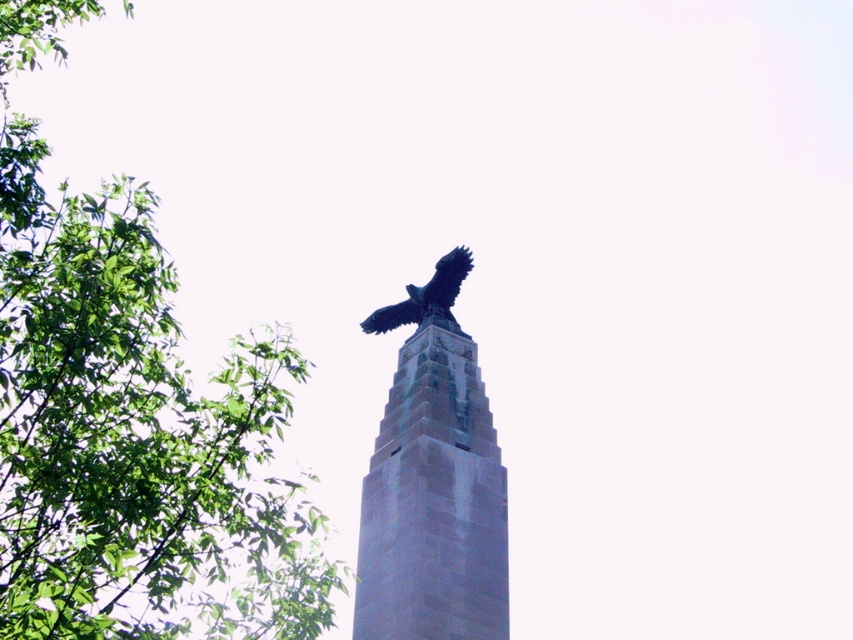
You are standing at the base of the monument and looking up at the two points marked on the image. Which point, point [146,476] or point [451,550], appears closer to you?

Point [146,476] appears closer to you because it is in front of point [451,550].

You are standing in front of the monument and want to place two markers at the coordinates point (x=247, y=506) and point (x=438, y=291). Which marker will be closer to you?

Point (x=247, y=506) is in front of point (x=438, y=291), so the marker at point (x=247, y=506) will be closer to you.

You are an architect reviewing a city park design. You notice the green leafy tree at upper left and the shiny black eagle at upper center in the design. Which object is located to the left of the other?

The green leafy tree at upper left is positioned on the left side of the shiny black eagle at upper center.